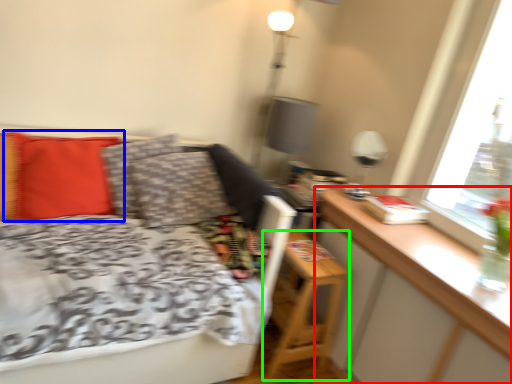
Question: Which object is positioned farthest from table (highlighted by a red box)? Select from pillow (highlighted by a blue box) and nightstand (highlighted by a green box).

Choices:
 (A) pillow
 (B) nightstand

Answer: (A)